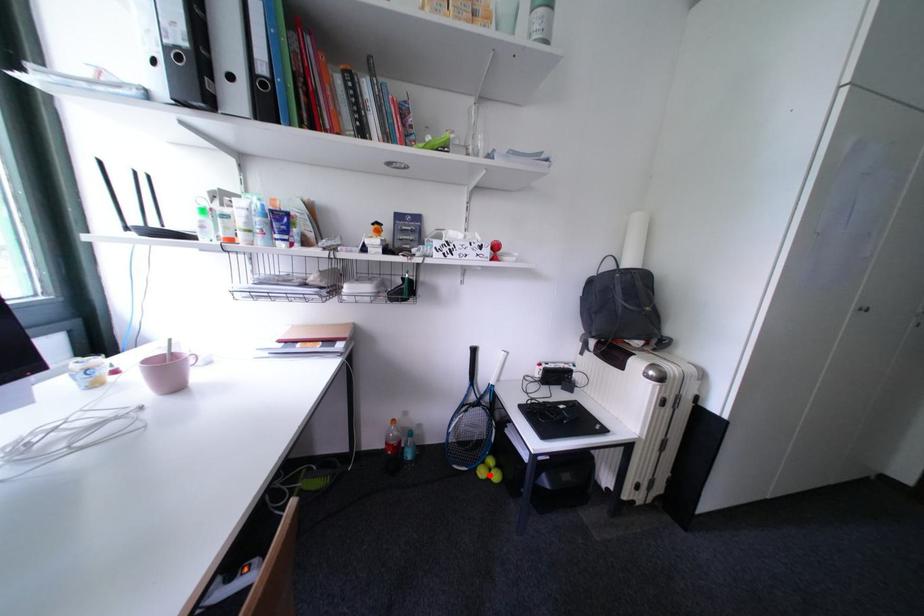
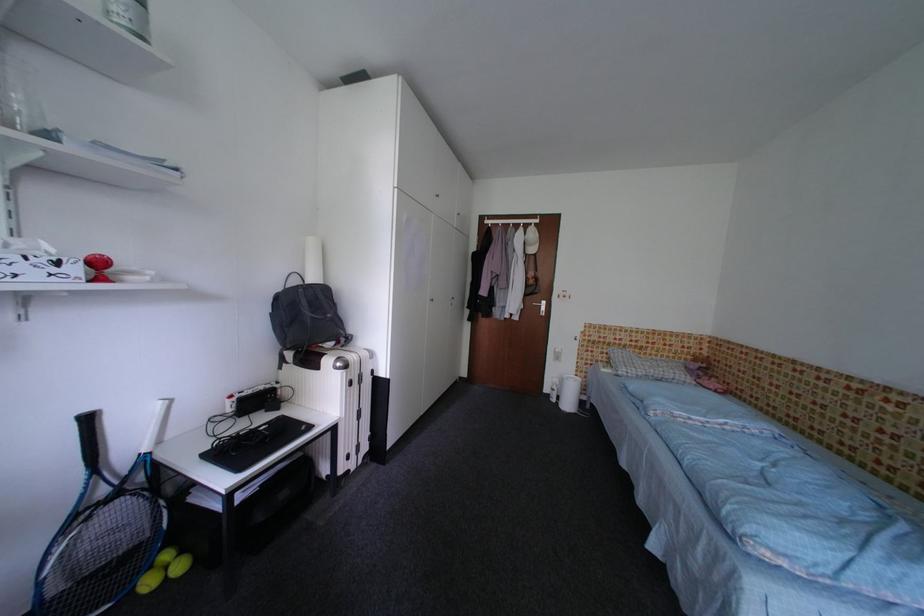
Find the pixel in the second image that matches the highlighted location in the first image.

(156, 586)